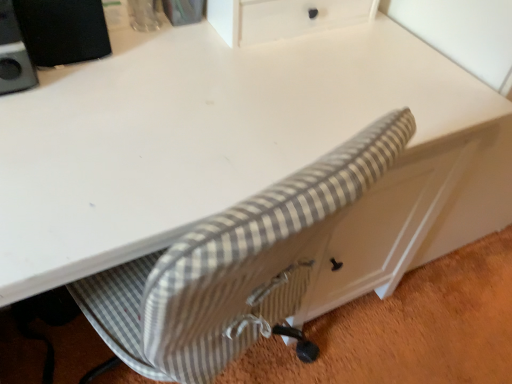
The width and height of the screenshot is (512, 384). In order to click on black matte speaker at upper left in this screenshot , I will do `click(62, 30)`.

This screenshot has width=512, height=384. What do you see at coordinates (62, 30) in the screenshot?
I see `black matte speaker at upper left` at bounding box center [62, 30].

The height and width of the screenshot is (384, 512). What do you see at coordinates (234, 266) in the screenshot?
I see `gray striped fabric chair at lower center` at bounding box center [234, 266].

You are a GUI agent. You are given a task and a screenshot of the screen. Output one action in this format:
    pyautogui.click(x=<x>, y=<y>)
    Task: Click on the gray striped fabric chair at lower center
    The width and height of the screenshot is (512, 384).
    Given the screenshot: What is the action you would take?
    pyautogui.click(x=234, y=266)

The width and height of the screenshot is (512, 384). I want to click on black matte speaker at upper left, so (62, 30).

Between gray striped fabric chair at lower center and black matte speaker at upper left, which one appears on the left side from the viewer's perspective?

Positioned to the left is black matte speaker at upper left.

Which object is more forward, gray striped fabric chair at lower center or black matte speaker at upper left?

black matte speaker at upper left is in front.

Which is closer to the camera, (216, 351) or (29, 31)?

Point (216, 351) is closer to the camera than point (29, 31).

From the image's perspective, is gray striped fabric chair at lower center positioned above or below black matte speaker at upper left?

Clearly, from the image's perspective, gray striped fabric chair at lower center is below black matte speaker at upper left.

From a real-world perspective, which is physically above, gray striped fabric chair at lower center or black matte speaker at upper left?

In real-world perspective, black matte speaker at upper left is above.

Can you confirm if gray striped fabric chair at lower center is wider than black matte speaker at upper left?

Correct, the width of gray striped fabric chair at lower center exceeds that of black matte speaker at upper left.

In the scene shown: Can you confirm if gray striped fabric chair at lower center is taller than black matte speaker at upper left?

No, gray striped fabric chair at lower center is not taller than black matte speaker at upper left.

Between gray striped fabric chair at lower center and black matte speaker at upper left, which one has smaller size?

black matte speaker at upper left is smaller.

Is gray striped fabric chair at lower center located outside black matte speaker at upper left?

That's correct, gray striped fabric chair at lower center is outside of black matte speaker at upper left.

Is gray striped fabric chair at lower center far away from black matte speaker at upper left?

No.

Is gray striped fabric chair at lower center oriented away from black matte speaker at upper left?

No.

Where is `chair below the black matte speaker at upper left (from a real-world perspective)`? The height and width of the screenshot is (384, 512). chair below the black matte speaker at upper left (from a real-world perspective) is located at coordinates (234, 266).

In the scene shown: Considering the positions of objects black matte speaker at upper left and gray striped fabric chair at lower center in the image provided, who is more to the left, black matte speaker at upper left or gray striped fabric chair at lower center?

black matte speaker at upper left.

In the image, is black matte speaker at upper left positioned in front of or behind gray striped fabric chair at lower center?

Visually, black matte speaker at upper left is located in front of gray striped fabric chair at lower center.

Does point (89, 34) come farther from viewer compared to point (403, 111)?

Yes, point (89, 34) is farther from viewer.

From the image's perspective, would you say black matte speaker at upper left is shown under gray striped fabric chair at lower center?

Incorrect, from the image's perspective, black matte speaker at upper left is higher than gray striped fabric chair at lower center.

From a real-world perspective, relative to gray striped fabric chair at lower center, is black matte speaker at upper left vertically above or below?

In terms of real-world spatial position, black matte speaker at upper left is above gray striped fabric chair at lower center.

Is black matte speaker at upper left wider or thinner than gray striped fabric chair at lower center?

Considering their sizes, black matte speaker at upper left looks slimmer than gray striped fabric chair at lower center.

Who is taller, black matte speaker at upper left or gray striped fabric chair at lower center?

With more height is black matte speaker at upper left.

Based on their sizes in the image, would you say black matte speaker at upper left is bigger or smaller than gray striped fabric chair at lower center?

black matte speaker at upper left is smaller than gray striped fabric chair at lower center.

Can we say black matte speaker at upper left lies outside gray striped fabric chair at lower center?

That's correct, black matte speaker at upper left is outside of gray striped fabric chair at lower center.

Are black matte speaker at upper left and gray striped fabric chair at lower center far apart?

That's not correct — black matte speaker at upper left is a little close to gray striped fabric chair at lower center.

Is black matte speaker at upper left positioned with its back to gray striped fabric chair at lower center?

black matte speaker at upper left does not have its back to gray striped fabric chair at lower center.

Image resolution: width=512 pixels, height=384 pixels. In order to click on chair located below the black matte speaker at upper left (from the image's perspective) in this screenshot , I will do `click(234, 266)`.

In order to click on chair on the right of black matte speaker at upper left in this screenshot , I will do `click(234, 266)`.

Image resolution: width=512 pixels, height=384 pixels. I want to click on chair below the black matte speaker at upper left (from a real-world perspective), so click(234, 266).